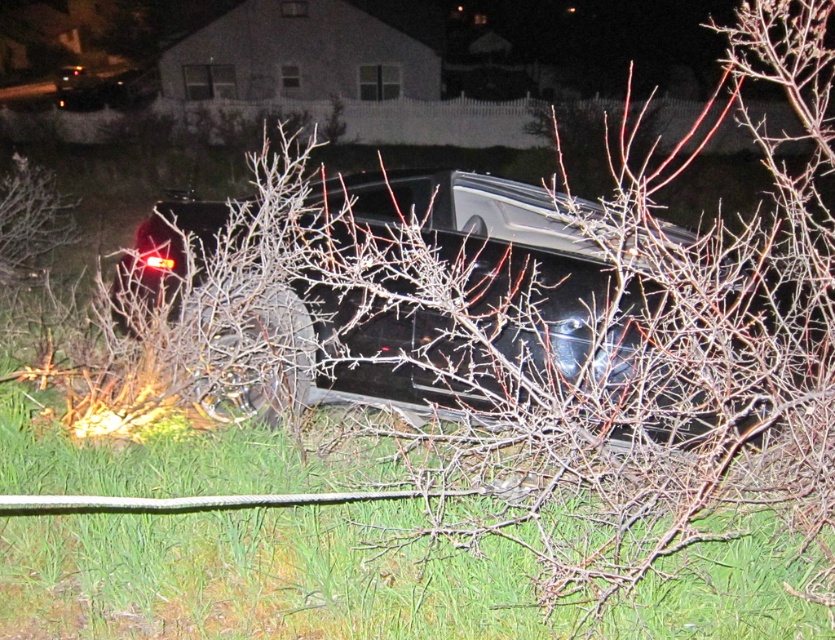
Question: Which point is closer to the camera taking this photo?

Choices:
 (A) (749, 608)
 (B) (499, 346)

Answer: (A)

Question: Which object is closer to the camera taking this photo?

Choices:
 (A) green grass at lower center
 (B) glossy black car at center

Answer: (A)

Question: Can you confirm if green grass at lower center is positioned above glossy black car at center?

Choices:
 (A) no
 (B) yes

Answer: (A)

Question: Can you confirm if green grass at lower center is wider than glossy black car at center?

Choices:
 (A) yes
 (B) no

Answer: (A)

Question: Can you confirm if green grass at lower center is wider than glossy black car at center?

Choices:
 (A) no
 (B) yes

Answer: (B)